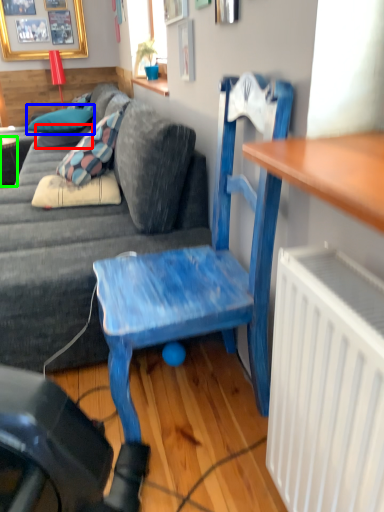
Question: Based on their relative distances, which object is nearer to pillow (highlighted by a red box)? Choose from pillow (highlighted by a blue box) and desk (highlighted by a green box).

Choices:
 (A) pillow
 (B) desk

Answer: (A)